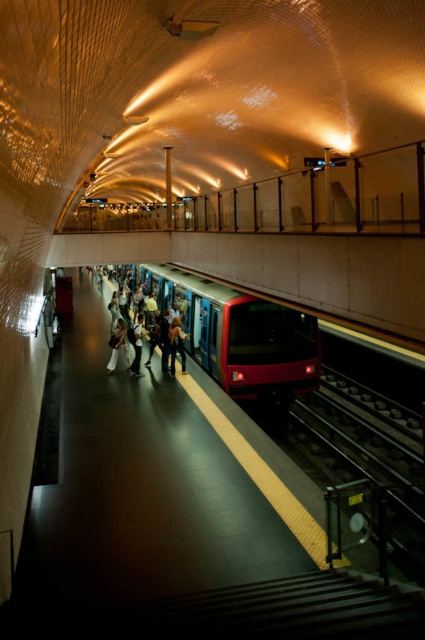
Question: Where is metallic red train at center located in relation to light beige fabric jacket at center in the image?

Choices:
 (A) left
 (B) right

Answer: (B)

Question: Can you confirm if metallic red train at center is smaller than light beige fabric dress at center?

Choices:
 (A) yes
 (B) no

Answer: (B)

Question: Among these points, which one is farthest from the camera?

Choices:
 (A) (198, 300)
 (B) (116, 356)
 (C) (122, 312)

Answer: (C)

Question: Among these objects, which one is farthest from the camera?

Choices:
 (A) metallic red train at center
 (B) light beige fabric bag at center
 (C) denim jacket at center

Answer: (B)

Question: Which of the following is the farthest from the observer?

Choices:
 (A) (153, 285)
 (B) (122, 342)
 (C) (136, 364)

Answer: (A)

Question: Where is light beige fabric dress at center located in relation to denim jacket at center in the image?

Choices:
 (A) below
 (B) above

Answer: (A)